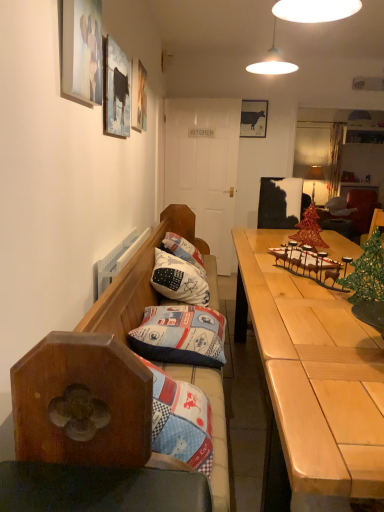
Question: Is matte wooden picture frame at upper left, acting as the second picture frame starting from the left, in front of or behind white cotton pillow at center, placed as the first pillow when sorted from back to front, in the image?

Choices:
 (A) front
 (B) behind

Answer: (A)

Question: Is matte wooden picture frame at upper left, arranged as the 3th picture frame when viewed from the back, spatially inside white cotton pillow at center, the 2th pillow in the front-to-back sequence, or outside of it?

Choices:
 (A) outside
 (B) inside

Answer: (A)

Question: Estimate the real-world distances between objects in this image. Which object is farther from the wooden bench with cushions at left?

Choices:
 (A) light wood table at right
 (B) matte glass lampshade at upper right
 (C) matte wooden picture frame at upper left, the 1th picture frame viewed from the front
 (D) white cotton pillow at center, the 2th pillow in the front-to-back sequence
 (E) matte black cow at upper center, placed as the first picture frame when sorted from right to left

Answer: (B)

Question: Which of these objects is positioned farthest from the white cotton pillow at center, the 2th pillow in the front-to-back sequence?

Choices:
 (A) matte black cow at upper center, placed as the 4th picture frame when sorted from front to back
 (B) blue cotton cushion at center, placed as the 2th pillow when sorted from back to front
 (C) light wood table at right
 (D) matte wooden picture frame at upper left, the 1th picture frame viewed from the front
 (E) wooden picture frame at upper center, which is the 3th picture frame from front to back

Answer: (A)